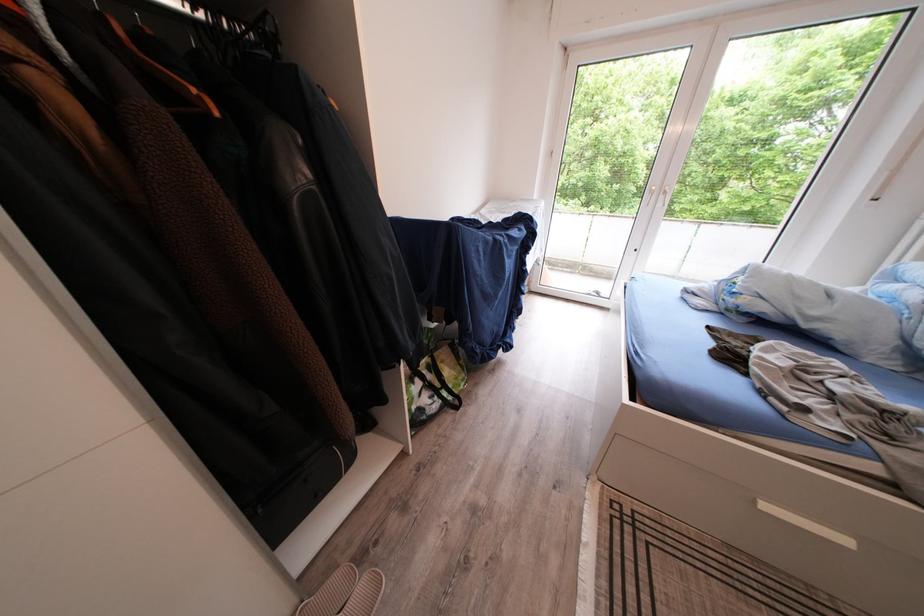
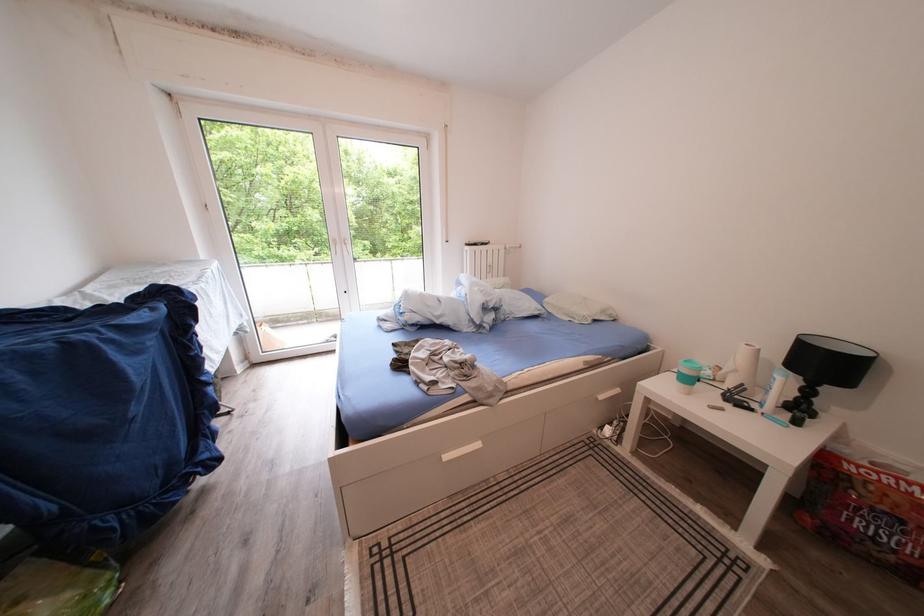
Question: How did the camera likely rotate?

Choices:
 (A) Left
 (B) Right
 (C) Up
 (D) Down

Answer: (B)